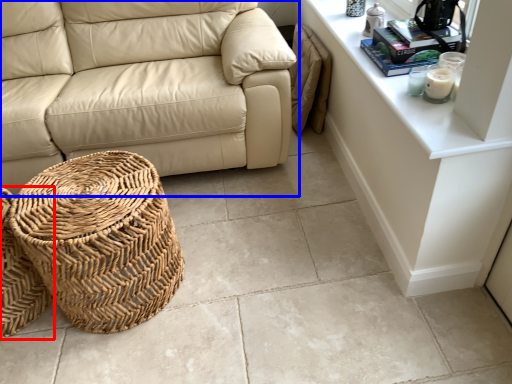
Question: Which object is further to the camera taking this photo, basket (highlighted by a red box) or studio couch (highlighted by a blue box)?

Choices:
 (A) basket
 (B) studio couch

Answer: (B)